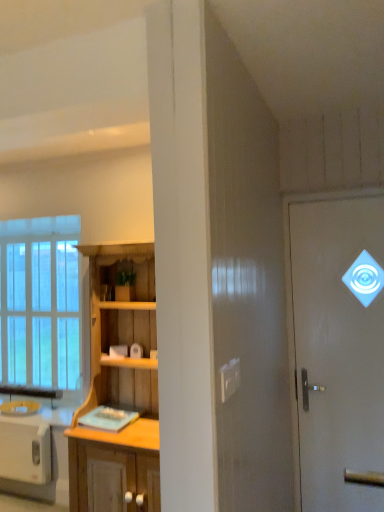
What are the coordinates of `vacant region above white glossy toaster at lower left (from a real-world perspective)` in the screenshot? It's located at click(x=20, y=422).